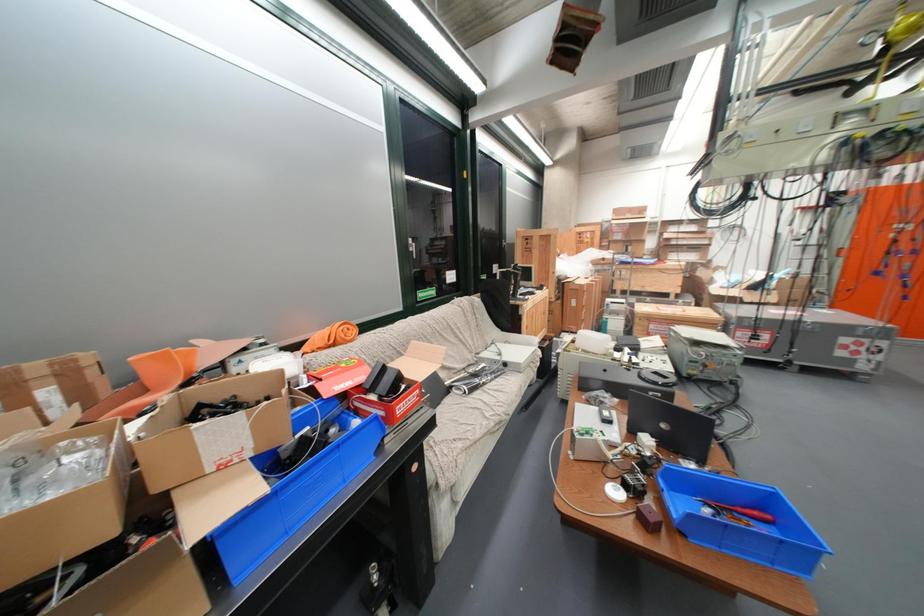
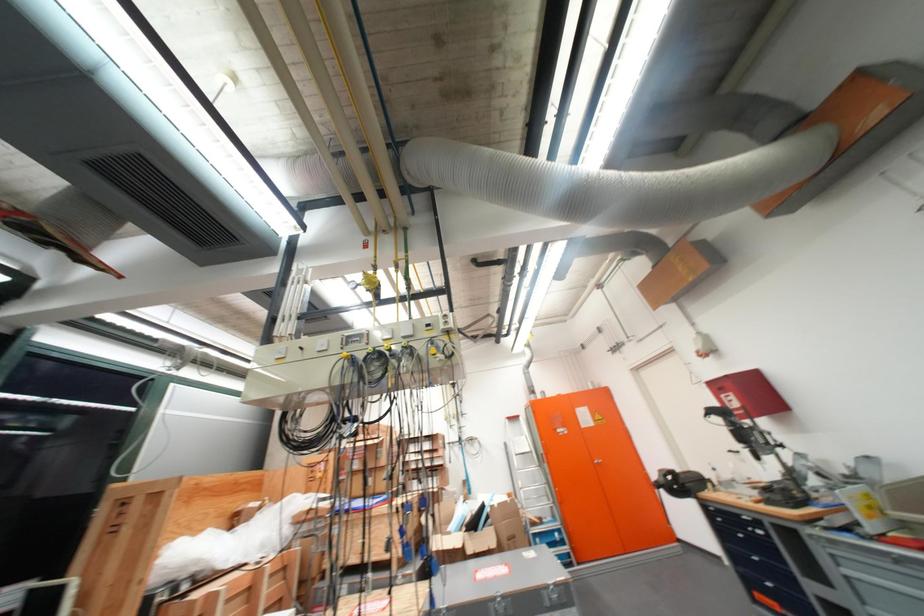
In the second image, find the point that corresponds to [582,286] in the first image.

(187, 610)